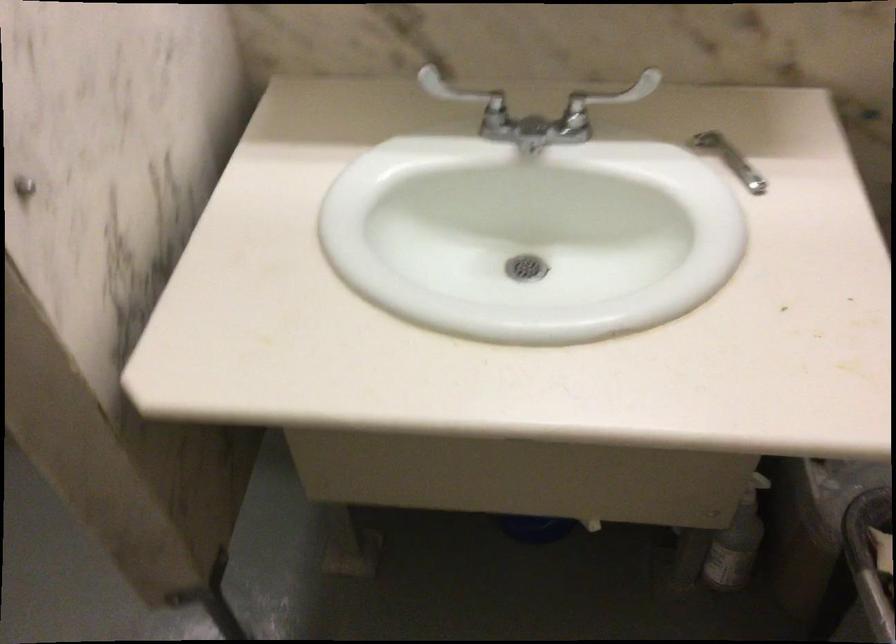
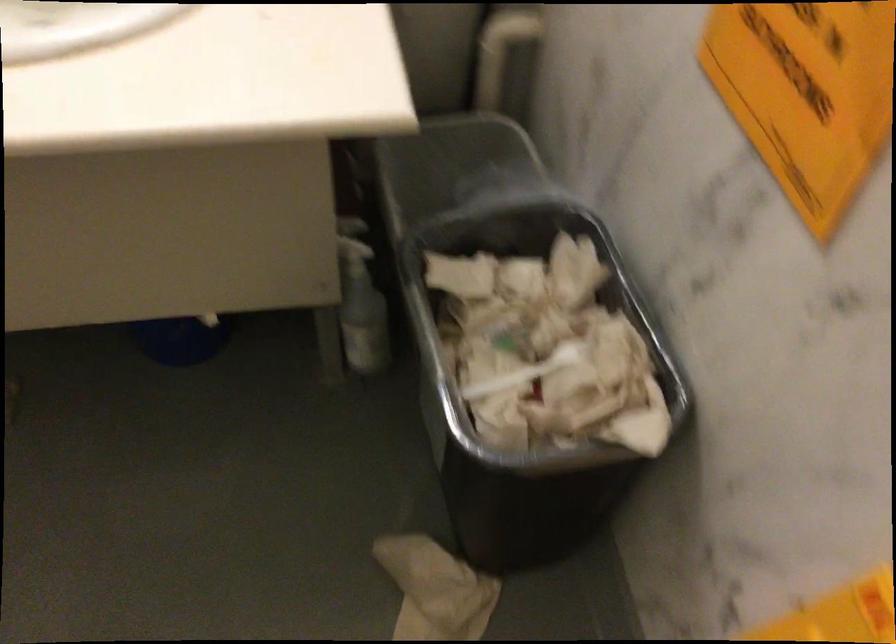
Question: The camera is either moving clockwise (left) or counter-clockwise (right) around the object. The first image is from the beginning of the video and the second image is from the end. Is the camera moving left or right when shooting the video?

Choices:
 (A) Left
 (B) Right

Answer: (A)